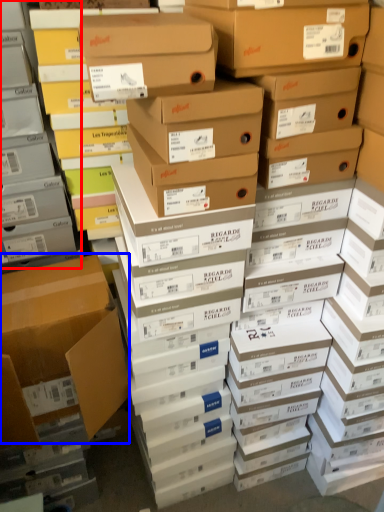
Question: Which point is further to the camera, shelf (highlighted by a red box) or box (highlighted by a blue box)?

Choices:
 (A) shelf
 (B) box

Answer: (B)